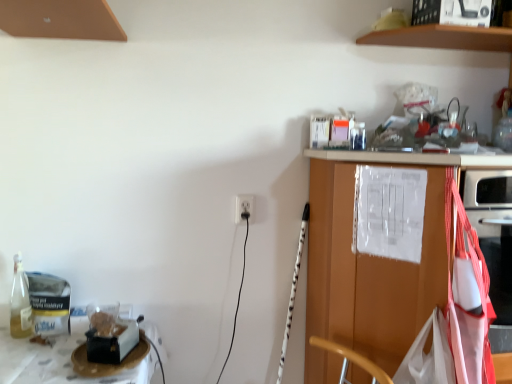
Question: Is wooden cabinet at right behind brown wooden shelf at upper center?

Choices:
 (A) yes
 (B) no

Answer: (B)

Question: Is wooden cabinet at right to the left of brown wooden shelf at upper center from the viewer's perspective?

Choices:
 (A) no
 (B) yes

Answer: (B)

Question: From a real-world perspective, is wooden cabinet at right positioned under brown wooden shelf at upper center based on gravity?

Choices:
 (A) no
 (B) yes

Answer: (B)

Question: Is wooden cabinet at right facing towards brown wooden shelf at upper center?

Choices:
 (A) no
 (B) yes

Answer: (A)

Question: Does wooden cabinet at right appear on the right side of brown wooden shelf at upper center?

Choices:
 (A) yes
 (B) no

Answer: (B)

Question: Does wooden cabinet at right touch brown wooden shelf at upper center?

Choices:
 (A) yes
 (B) no

Answer: (B)

Question: Considering the relative sizes of brown wooden shelf at upper center and wooden cabinet at right in the image provided, is brown wooden shelf at upper center wider than wooden cabinet at right?

Choices:
 (A) no
 (B) yes

Answer: (A)

Question: From a real-world perspective, is brown wooden shelf at upper center positioned over wooden cabinet at right based on gravity?

Choices:
 (A) yes
 (B) no

Answer: (A)

Question: Considering the relative sizes of brown wooden shelf at upper center and wooden cabinet at right in the image provided, is brown wooden shelf at upper center smaller than wooden cabinet at right?

Choices:
 (A) no
 (B) yes

Answer: (B)

Question: From the image's perspective, is brown wooden shelf at upper center under wooden cabinet at right?

Choices:
 (A) yes
 (B) no

Answer: (B)

Question: Is brown wooden shelf at upper center surrounding wooden cabinet at right?

Choices:
 (A) no
 (B) yes

Answer: (A)

Question: From a real-world perspective, is brown wooden shelf at upper center located beneath wooden cabinet at right?

Choices:
 (A) yes
 (B) no

Answer: (B)

Question: From a real-world perspective, is wooden cabinet at right positioned over white plastic electric outlet at center based on gravity?

Choices:
 (A) no
 (B) yes

Answer: (A)